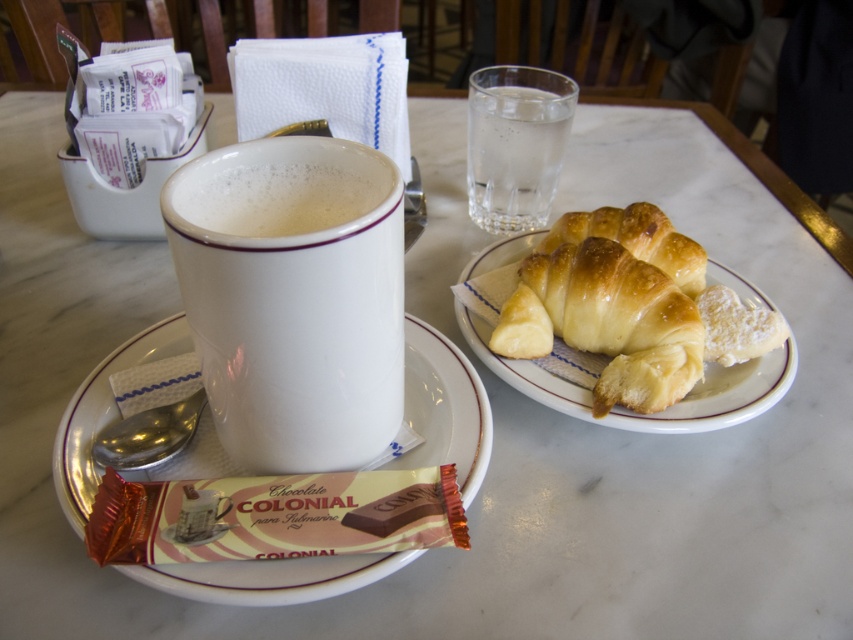
Question: Considering the real-world distances, which object is closest to the golden flaky croissant at upper right?

Choices:
 (A) white matte mug at upper center
 (B) white glossy mug at center

Answer: (A)

Question: Can you confirm if white glossy mug at center is bigger than golden flaky croissant at upper right?

Choices:
 (A) no
 (B) yes

Answer: (B)

Question: Is white glossy mug at center in front of golden-brown flaky croissant at center-right?

Choices:
 (A) no
 (B) yes

Answer: (B)

Question: Which point is closer to the camera?

Choices:
 (A) clear glass water at upper center
 (B) white ceramic saucer at lower left

Answer: (B)

Question: Which object is the farthest from the white ceramic saucer at lower left?

Choices:
 (A) golden flaky croissant at upper right
 (B) white glossy mug at center

Answer: (A)

Question: Does white glossy mug at center come behind white matte mug at upper center?

Choices:
 (A) yes
 (B) no

Answer: (B)